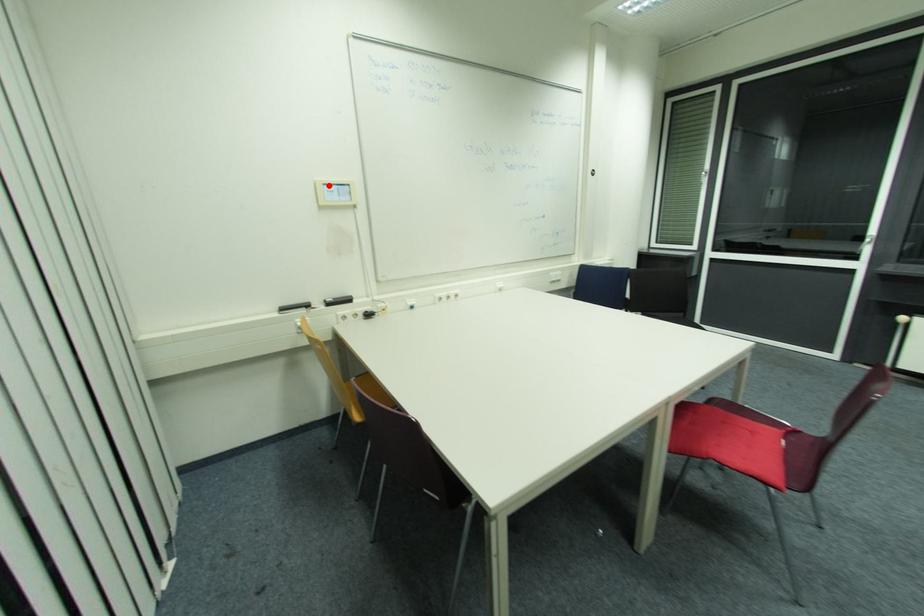
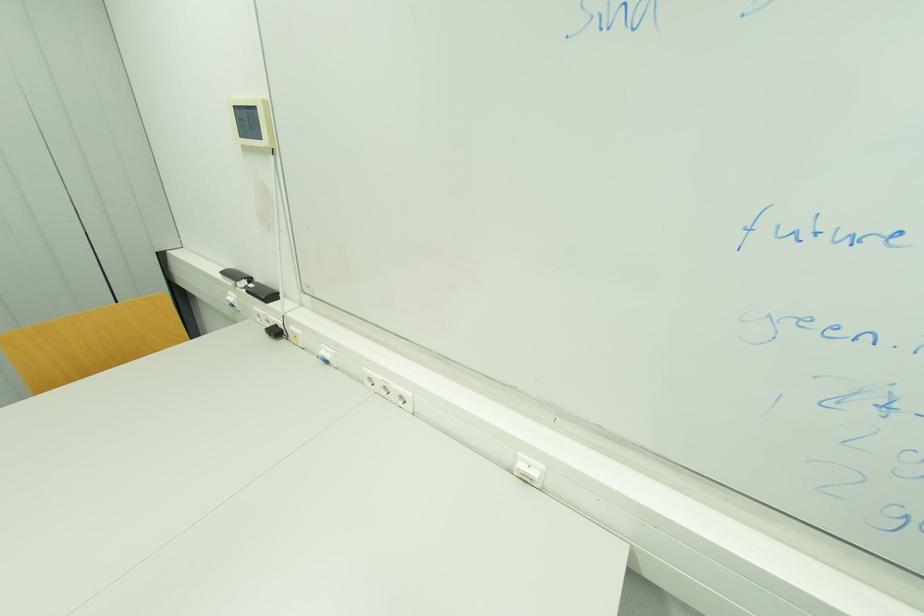
Locate, in the second image, the point that corresponds to the highlighted location in the first image.

(237, 108)